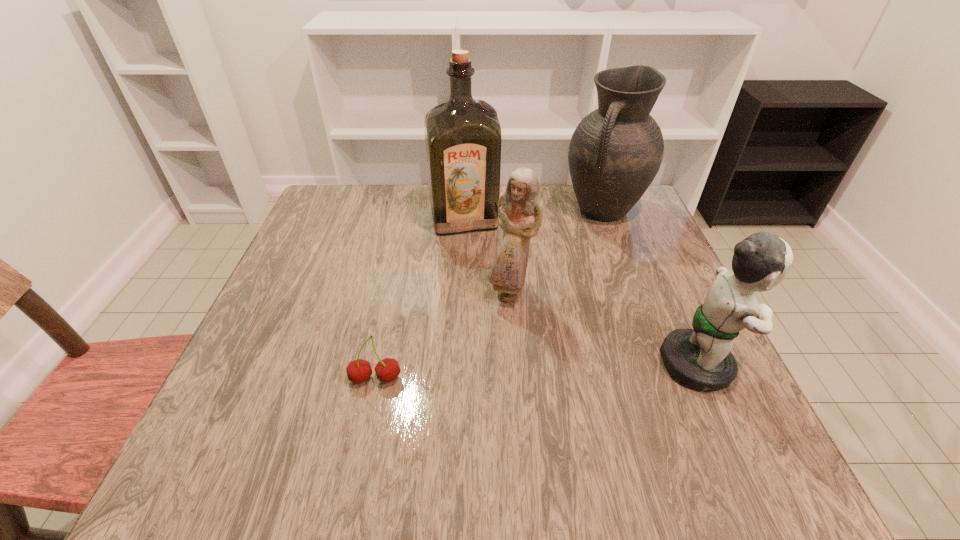
Identify the location of vacant region located on the label of the liquor. The height and width of the screenshot is (540, 960). (480, 275).

Where is `vacant region located 0.070m on the front-facing side of the left figurine`? vacant region located 0.070m on the front-facing side of the left figurine is located at coordinates (521, 335).

Find the location of a particular element. This screenshot has width=960, height=540. free space located 0.260m on the front-facing side of the left figurine is located at coordinates (542, 421).

Where is `vacant space located on the front-facing side of the left figurine`? The width and height of the screenshot is (960, 540). vacant space located on the front-facing side of the left figurine is located at coordinates (544, 427).

In order to click on vacant space located 0.120m on the side of the pitcher with the handle in this screenshot , I will do `click(572, 258)`.

Locate an element on the screen. vacant area situated on the side of the pitcher with the handle is located at coordinates (530, 322).

What are the coordinates of `free space located on the side of the pitcher with the handle` in the screenshot? It's located at (562, 274).

Locate an element on the screen. liquor that is positioned at the far edge is located at coordinates (463, 138).

Find the location of `pitcher at the far edge`. pitcher at the far edge is located at coordinates (615, 152).

The image size is (960, 540). What are the coordinates of `cherry that is at the near edge` in the screenshot? It's located at (387, 370).